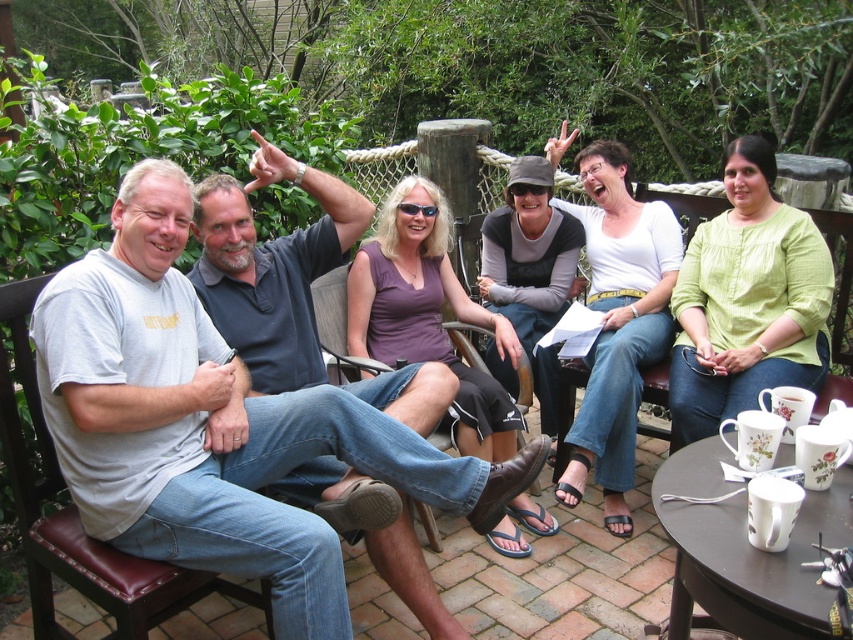
You are a guest at this outdoor gathering and need to choose a seat. You prefer a taller chair for better visibility. Which chair should you choose between the brown leather chair at left and the brown leather chair at center?

The brown leather chair at left is taller than the brown leather chair at center, so you should choose the brown leather chair at left for better visibility.

You are standing on the patio and want to walk from point A to point B. Point A is at coordinates point (51, 589) and point B is at coordinates point (312, 284). Since you can only move forward, will you pass through point B before reaching point A?

Point (51, 589) is in front of point (312, 284), so if you start at point A and move forward towards point B, you will reach point B before passing through point A. However, since you are starting at point A, you are already there and cannot pass through point B first.